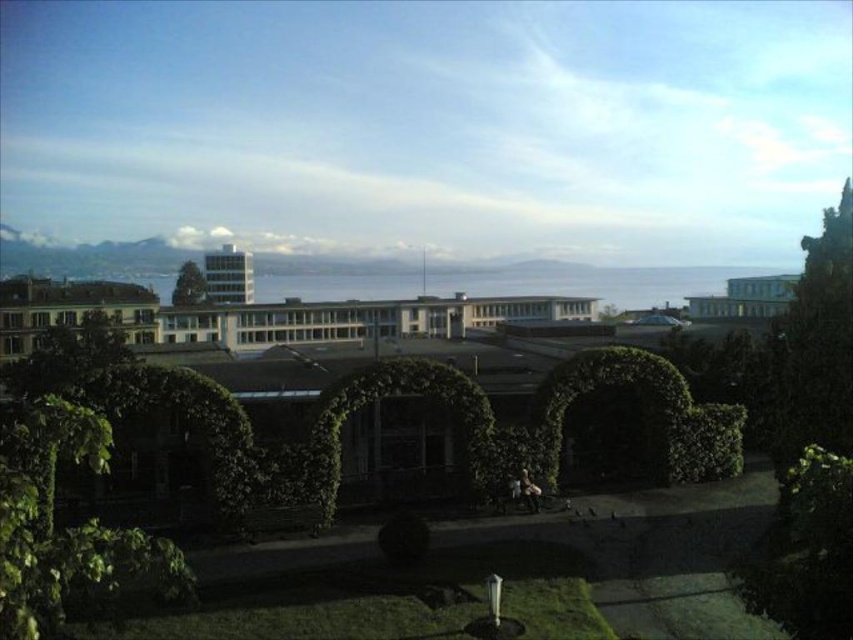
Question: Does green leafy tree at right have a greater width compared to green leafy tree at upper center?

Choices:
 (A) no
 (B) yes

Answer: (A)

Question: Is green leafy tree at right smaller than green leafy tree at upper center?

Choices:
 (A) yes
 (B) no

Answer: (A)

Question: Is green leafy tree at right to the right of green leafy tree at upper center from the viewer's perspective?

Choices:
 (A) no
 (B) yes

Answer: (B)

Question: Among these points, which one is farthest from the camera?

Choices:
 (A) pos(187,260)
 (B) pos(770,420)

Answer: (A)

Question: Which point is closer to the camera?

Choices:
 (A) [204, 296]
 (B) [776, 435]

Answer: (B)